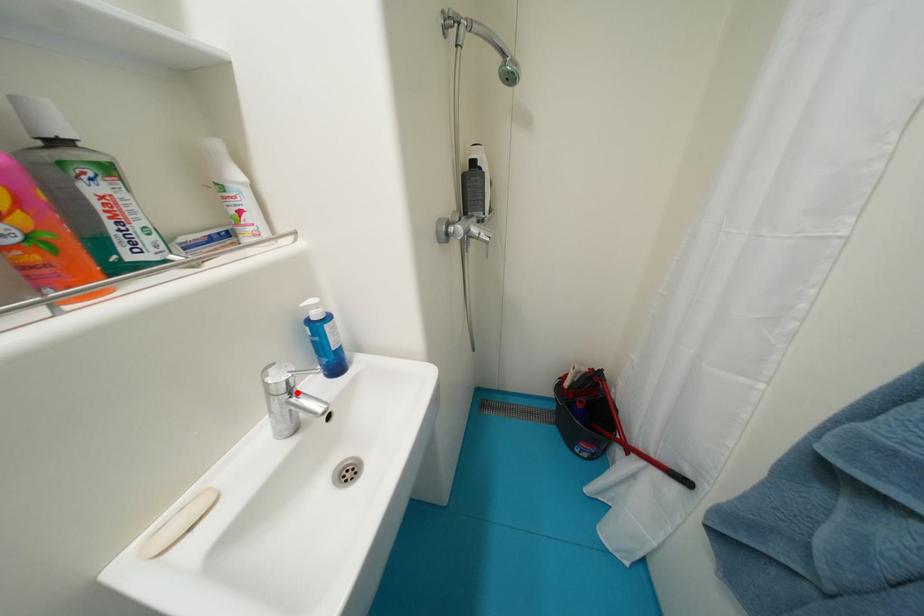
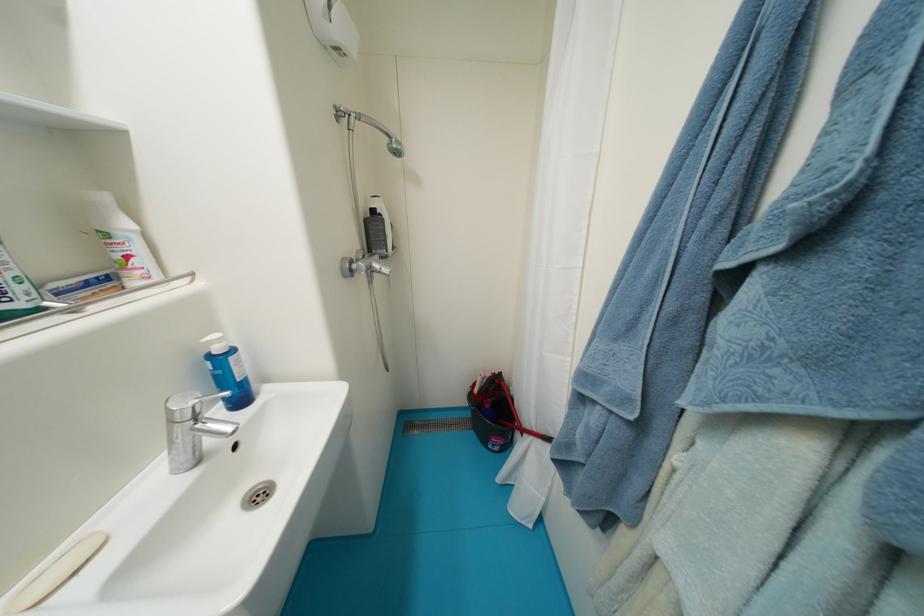
In the second image, find the point that corresponds to the highlighted location in the first image.

(203, 419)